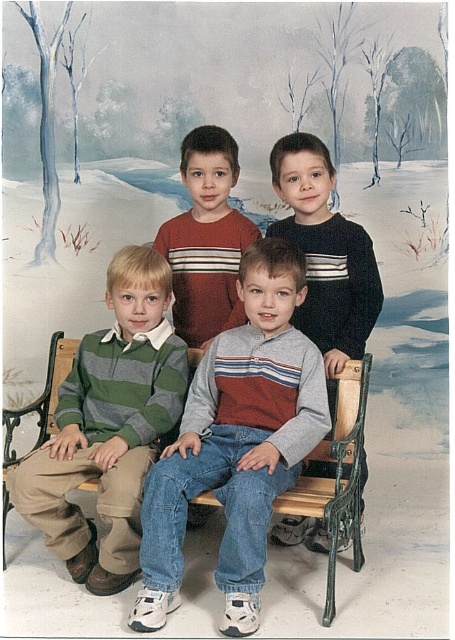
Question: Is striped knit sweater at center closer to the viewer compared to wooden bench at center?

Choices:
 (A) yes
 (B) no

Answer: (A)

Question: Which object is positioned closest to the striped sweater at center?

Choices:
 (A) wooden bench at center
 (B) striped knit sweater at center
 (C) green striped sweater at left

Answer: (C)

Question: Can you confirm if striped sweater at center is wider than wooden bench at center?

Choices:
 (A) yes
 (B) no

Answer: (B)

Question: Which of the following is the farthest from the observer?

Choices:
 (A) (343, 433)
 (B) (225, 202)
 (C) (236, 372)

Answer: (B)

Question: Which point appears farthest from the camera in this image?

Choices:
 (A) (50, 440)
 (B) (223, 387)
 (C) (225, 252)

Answer: (C)

Question: Is green striped sweater at left above wooden bench at center?

Choices:
 (A) yes
 (B) no

Answer: (A)